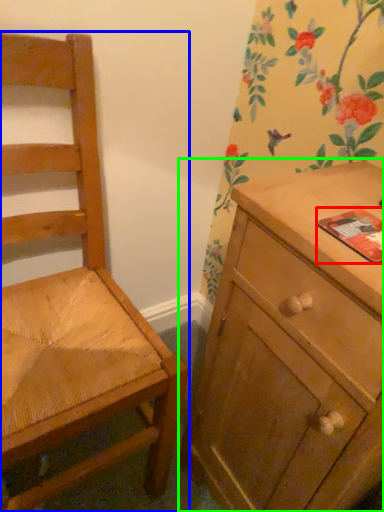
Question: Which object is positioned closest to paperback book (highlighted by a red box)? Select from chair (highlighted by a blue box) and chest of drawers (highlighted by a green box).

Choices:
 (A) chair
 (B) chest of drawers

Answer: (B)